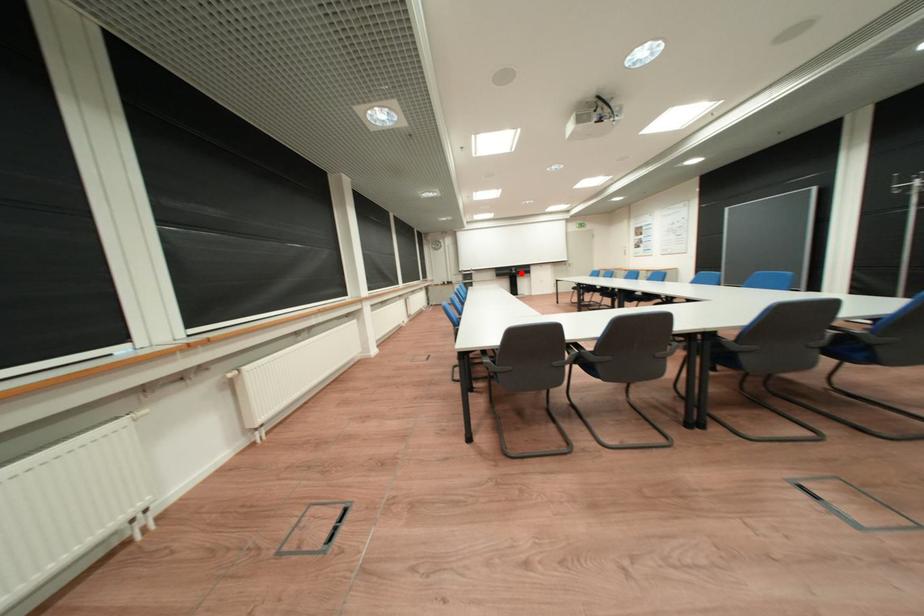
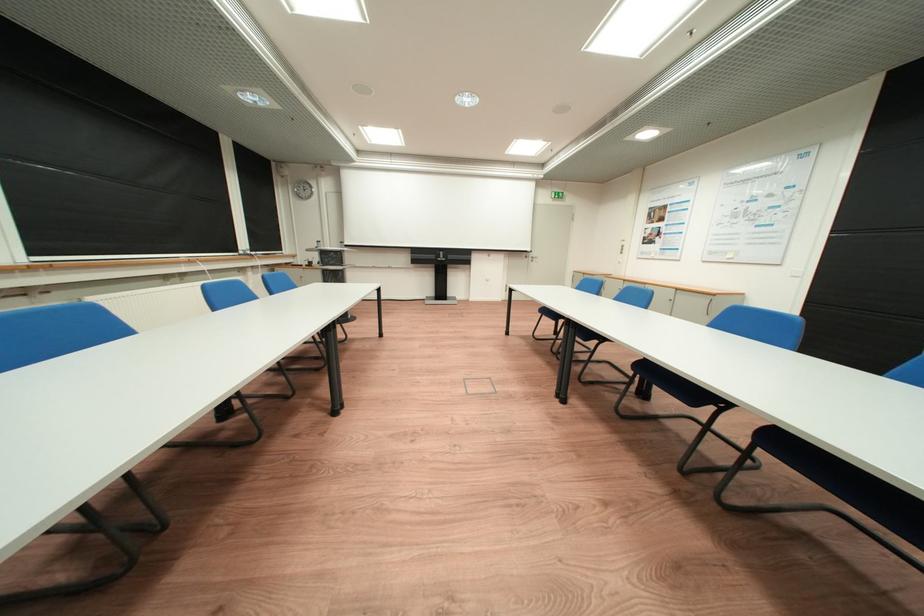
Question: I am providing you with two images of the same scene from different viewpoints. A red point is shown in image1. For the corresponding object point in image2, is it positioned nearer or farther from the camera?

Choices:
 (A) Nearer
 (B) Farther

Answer: (B)